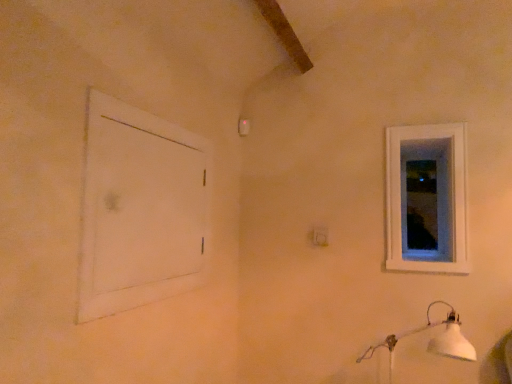
Question: Is transparent glass window at upper right in front of or behind white plastic electric outlet at center in the image?

Choices:
 (A) behind
 (B) front

Answer: (A)

Question: From the image's perspective, is transparent glass window at upper right positioned above or below white plastic electric outlet at center?

Choices:
 (A) below
 (B) above

Answer: (B)

Question: Which of these objects is positioned farthest from the transparent glass window at upper right?

Choices:
 (A) white plastic electric outlet at center
 (B) white matte lamp at lower right
 (C) white matte door at left
 (D) white wooden window at upper right

Answer: (C)

Question: Which object is the farthest from the transparent glass window at upper right?

Choices:
 (A) white matte lamp at lower right
 (B) white plastic electric outlet at center
 (C) white wooden window at upper right
 (D) white matte door at left

Answer: (D)